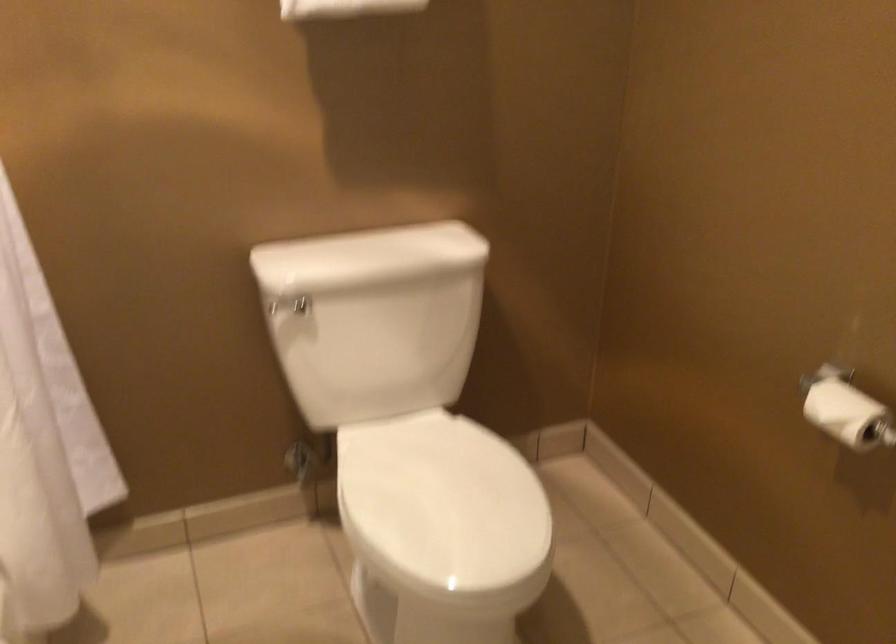
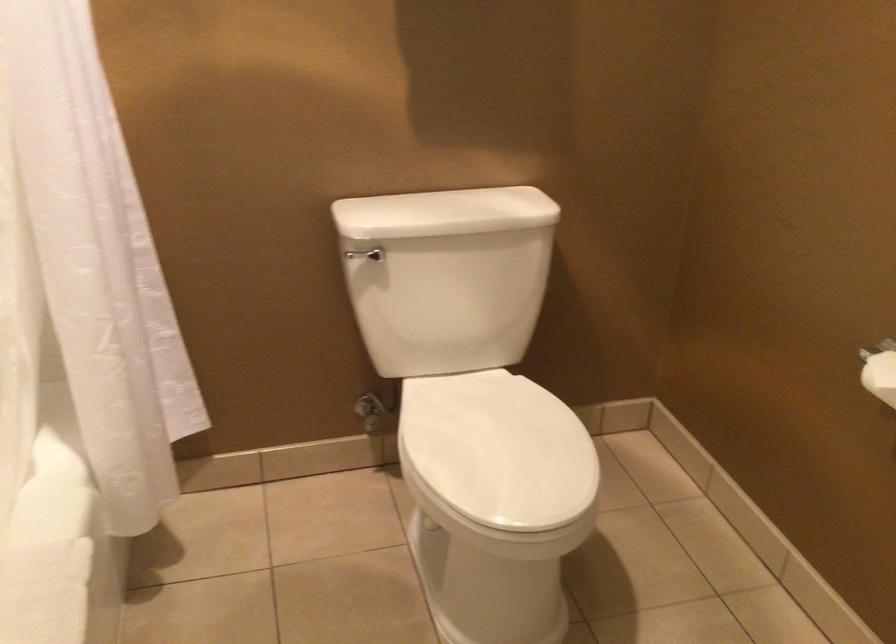
The point at (446, 505) is marked in the first image. Where is the corresponding point in the second image?

(498, 450)